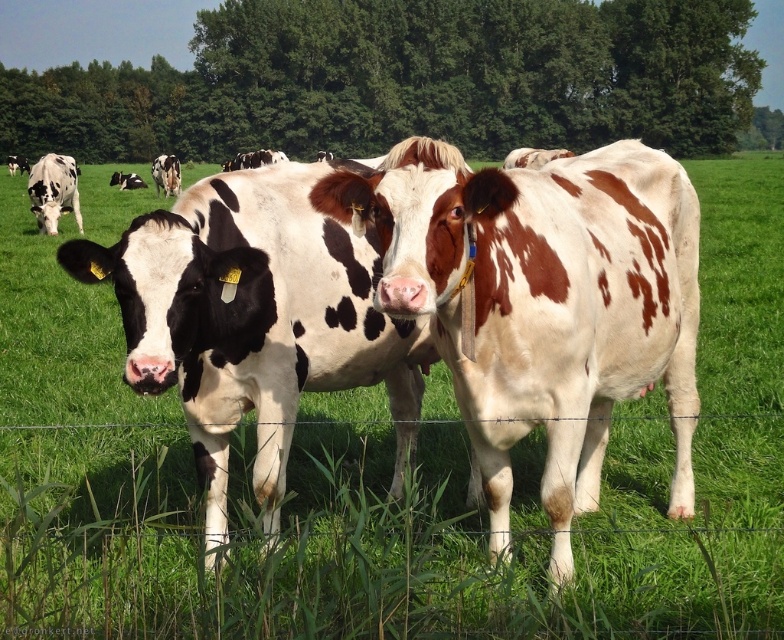
Can you confirm if brown spotted cow at center is shorter than black and white spotted cow at upper left?

Yes.

Between point (441, 333) and point (151, 168), which one is positioned in front?

Positioned in front is point (441, 333).

Identify the location of brown spotted cow at center. 543,305.

Who is positioned more to the left, brown spotted cow at center or black and white spotted cow at left?

From the viewer's perspective, black and white spotted cow at left appears more on the left side.

Image resolution: width=784 pixels, height=640 pixels. Describe the element at coordinates (543, 305) in the screenshot. I see `brown spotted cow at center` at that location.

At what (x,y) coordinates should I click in order to perform the action: click on brown spotted cow at center. Please return your answer as a coordinate pair (x, y). The height and width of the screenshot is (640, 784). Looking at the image, I should click on (543, 305).

Does black and white spotted cow at left appear on the right side of black and white spotted cow at upper left?

Yes, black and white spotted cow at left is to the right of black and white spotted cow at upper left.

Does black and white spotted cow at left have a greater height compared to black and white spotted cow at upper left?

Incorrect, black and white spotted cow at left's height is not larger of black and white spotted cow at upper left's.

What do you see at coordinates (53, 192) in the screenshot? The height and width of the screenshot is (640, 784). I see `black and white spotted cow at left` at bounding box center [53, 192].

Locate an element on the screen. This screenshot has width=784, height=640. black and white spotted cow at left is located at coordinates (53, 192).